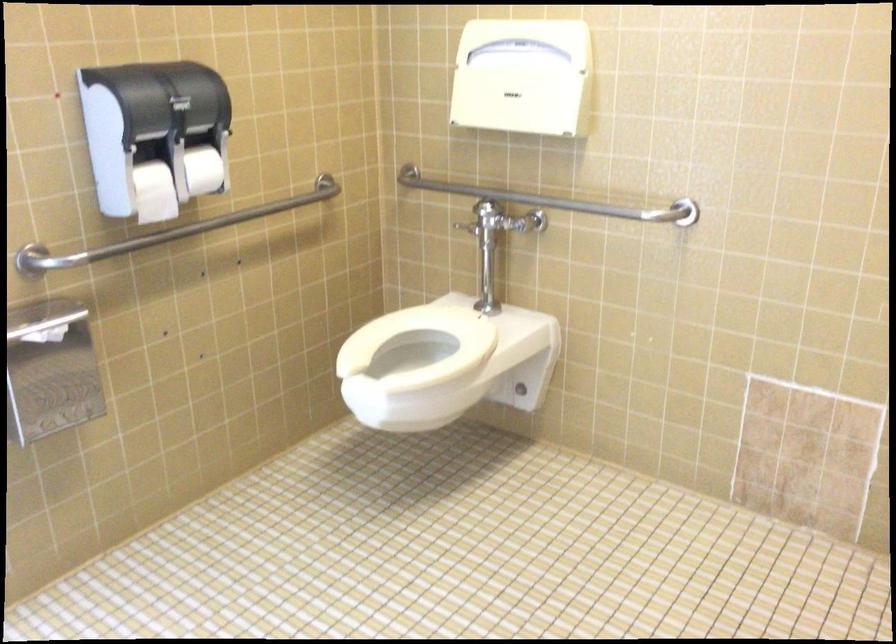
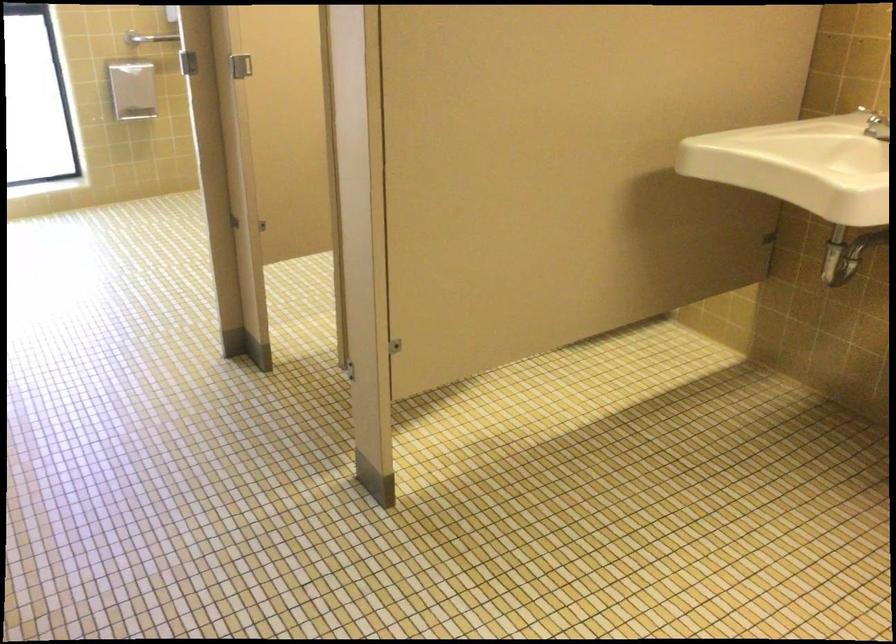
What movement of the cameraman would produce the second image?

The cameraman moved toward right, backward.